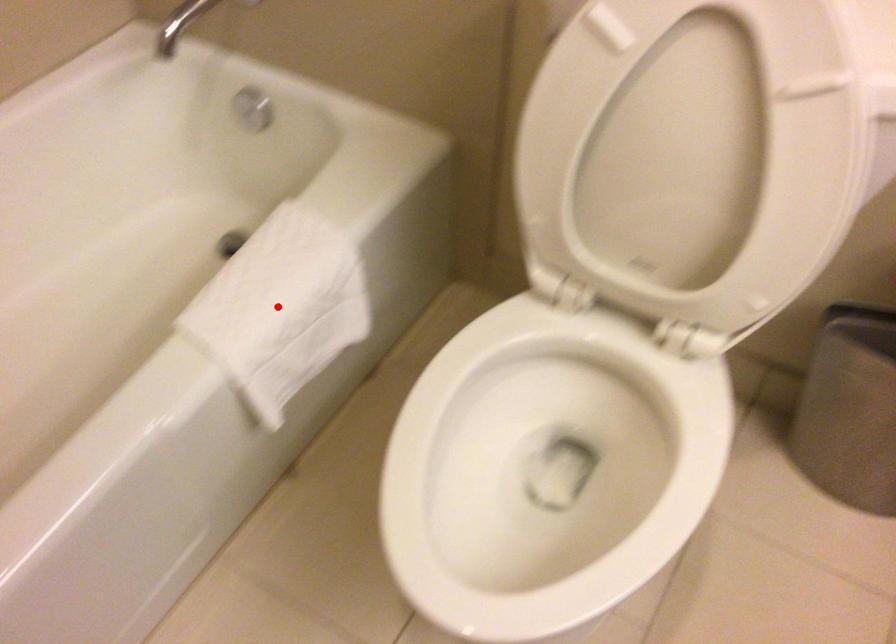
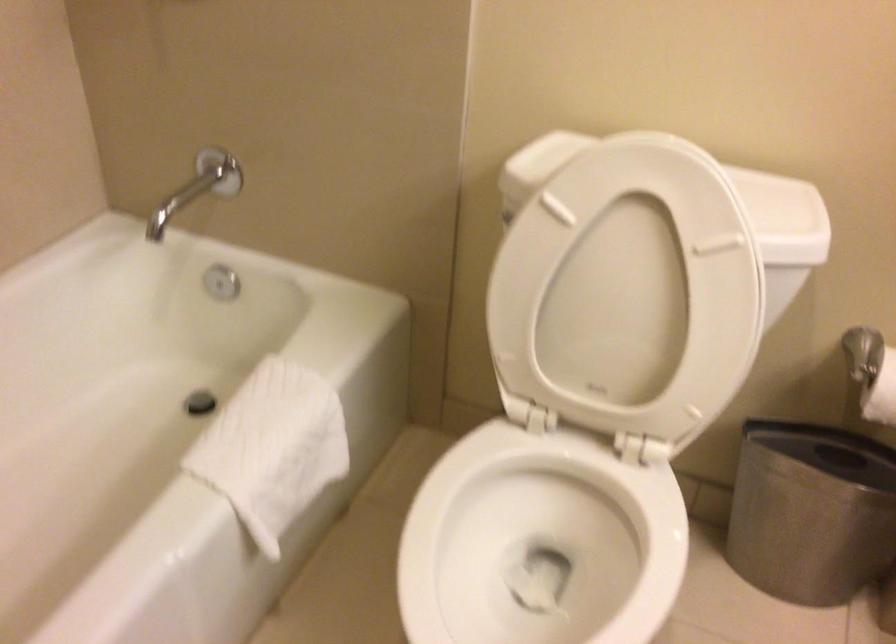
Question: I am providing you with two images of the same scene from different viewpoints. A red point is shown in image1. For the corresponding object point in image2, is it positioned nearer or farther from the camera?

Choices:
 (A) Nearer
 (B) Farther

Answer: (B)